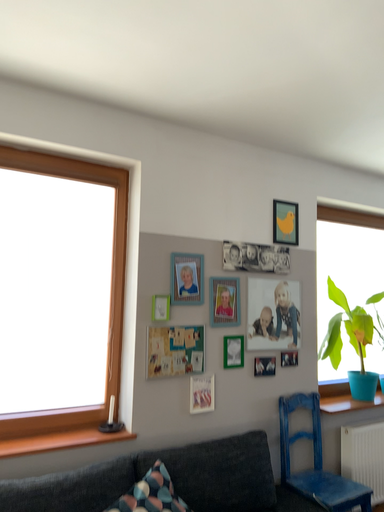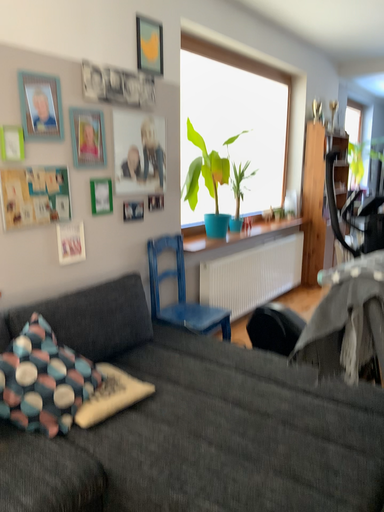
Question: Which way did the camera rotate in the video?

Choices:
 (A) rotated downward
 (B) rotated upward

Answer: (A)